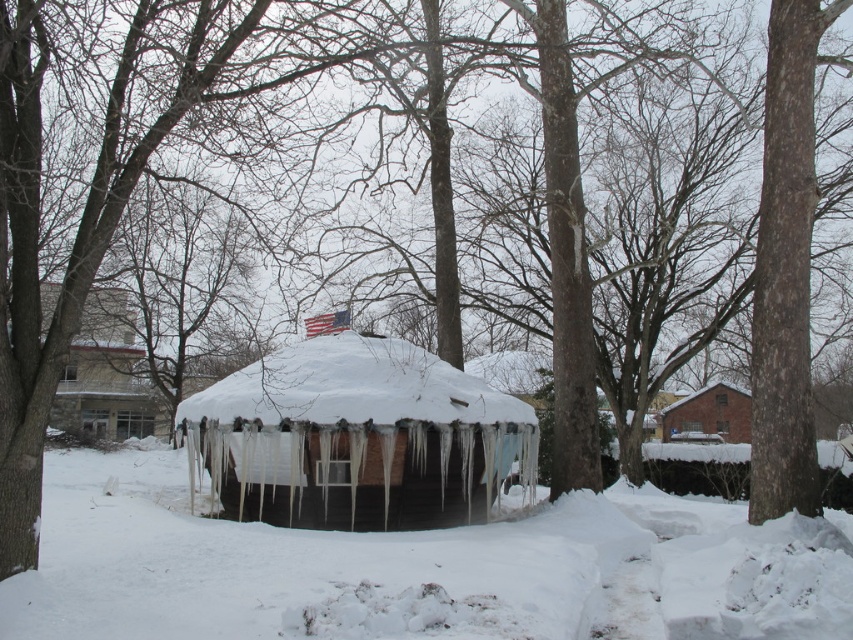
You are standing in the snowy winter scene and want to walk to the white wooden hut at center. Based on the position of the white frosty snow at center, will you need to step over or around it to reach your destination?

The white frosty snow at center is in front of the white wooden hut at center, so you will need to step over it to reach the white wooden hut at center.

You are standing at the point marked by the coordinates point (x=418, y=570) in the snowy winter scene. Describe what you see around you based on the scene description.

At point (x=418, y=570), you are at the center of the snowy winter scene. The round, dome shaped yurt covered in thick snow is in the center, with icicles hanging from its edges. The ground around you is blanketed in white snow, and leafless trees with snow covered branches surround the area. The American flag on top of the yurt is fluttering slightly in the wind.

You are standing at the point marked as point [700,419] and want to walk to the yurt in the snowy scene. Is the point marked as point [219,481] between you and the yurt?

Yes, point [219,481] is between you and the yurt because it is in front of point [700,419], which is your current position.